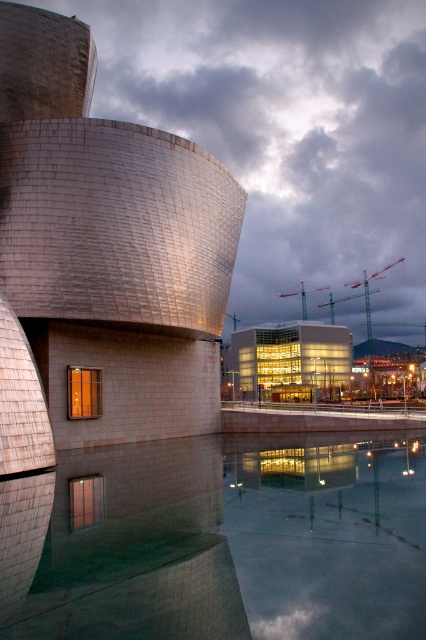
You are an architect analyzing the spatial relationship between the reflective glass water at lower center and the transparent glass building at center. Which object takes up more area in the image?

The transparent glass building at center occupies more space than the reflective glass water at lower center according to the description.

You are an architect analyzing the layout of the scene. Which object takes up more space in the image, the reflective glass water at lower center or the glass modern building at center?

The glass modern building at center occupies more space in the image than the reflective glass water at lower center according to the description.

You are an architect analyzing the image. You need to determine the vertical relationship between the reflective glass water at lower center and the transparent glass building at center. Which one has a greater height in the image?

The reflective glass water at lower center is taller than the transparent glass building at center according to the description.